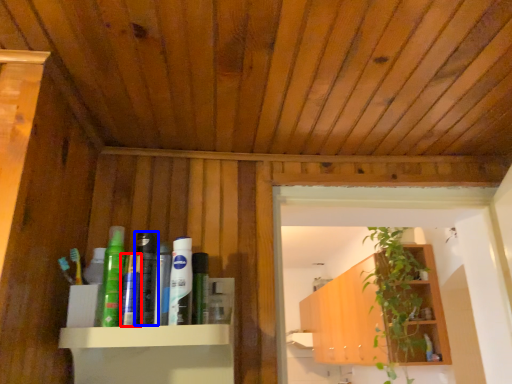
Question: Which point is further to the camera, toothpaste (highlighted by a red box) or toiletry (highlighted by a blue box)?

Choices:
 (A) toothpaste
 (B) toiletry

Answer: (B)